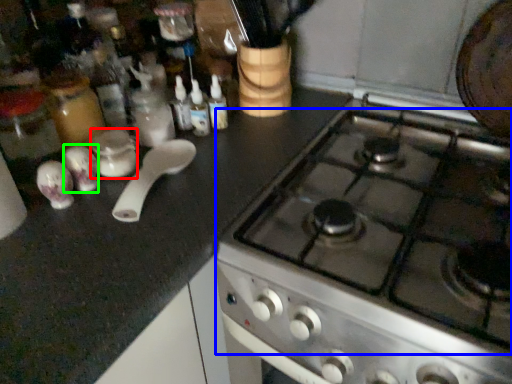
Question: Which object is the closest to the appliance (highlighted by a red box)? Choose among these: gas stove (highlighted by a blue box) or tableware (highlighted by a green box).

Choices:
 (A) gas stove
 (B) tableware

Answer: (B)